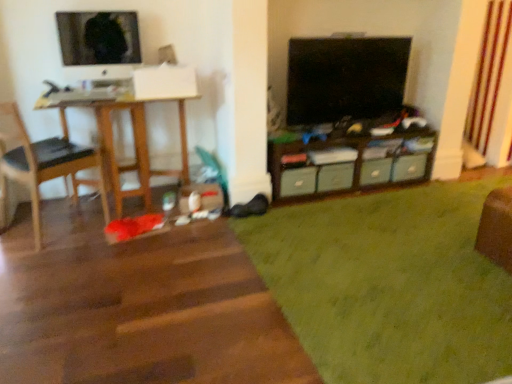
Where is `vacant space underneath black leather chair at left (from a real-world perspective)`? vacant space underneath black leather chair at left (from a real-world perspective) is located at coordinates (48, 228).